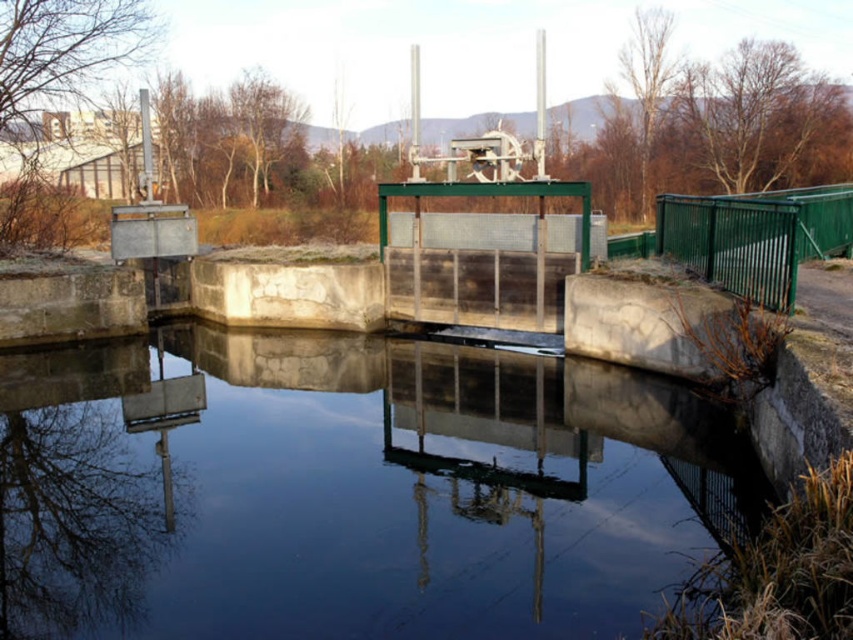
Between transparent water at center and green metallic fence at right, which one has less height?

With less height is transparent water at center.

Describe the element at coordinates (350, 490) in the screenshot. I see `transparent water at center` at that location.

At what (x,y) coordinates should I click in order to perform the action: click on transparent water at center. Please return your answer as a coordinate pair (x, y). The width and height of the screenshot is (853, 640). Looking at the image, I should click on (350, 490).